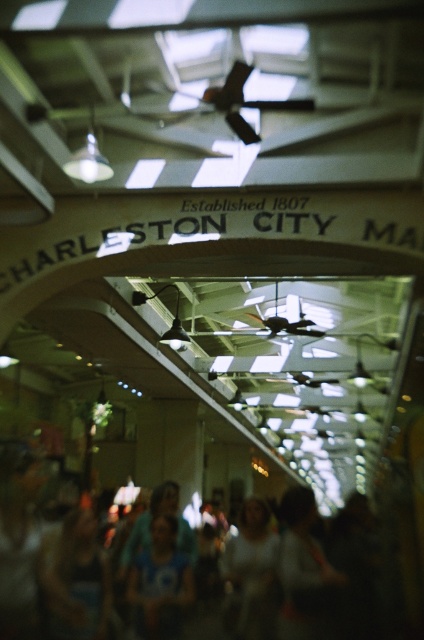
Question: Can you confirm if blurred cotton crowd at lower center is positioned below blue fabric shirt at center?

Choices:
 (A) no
 (B) yes

Answer: (B)

Question: Among these points, which one is nearest to the camera?

Choices:
 (A) (153, 524)
 (B) (187, 570)

Answer: (B)

Question: Does blurred cotton crowd at lower center lie behind blue fabric shirt at center?

Choices:
 (A) no
 (B) yes

Answer: (B)

Question: Which object appears closest to the camera in this image?

Choices:
 (A) blurred cotton crowd at lower center
 (B) blue fabric shirt at center

Answer: (B)

Question: Can you confirm if blurred cotton crowd at lower center is wider than blue fabric shirt at center?

Choices:
 (A) yes
 (B) no

Answer: (A)